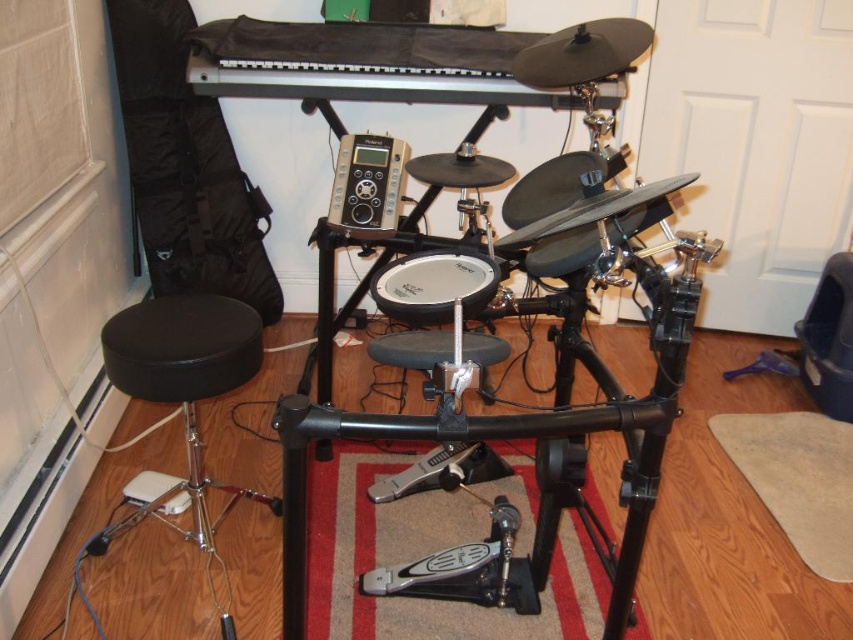
Is black leather stool at lower left smaller than silver metallic speaker at center?

Actually, black leather stool at lower left might be larger than silver metallic speaker at center.

Does black leather stool at lower left have a larger size compared to silver metallic speaker at center?

Yes, black leather stool at lower left is bigger than silver metallic speaker at center.

Between point (215, 323) and point (338, 179), which one is positioned behind?

Positioned behind is point (215, 323).

The image size is (853, 640). I want to click on black leather stool at lower left, so click(x=181, y=388).

Image resolution: width=853 pixels, height=640 pixels. What do you see at coordinates (363, 64) in the screenshot?
I see `black matte keyboard at upper center` at bounding box center [363, 64].

Can you confirm if black matte keyboard at upper center is positioned below silver metallic speaker at center?

No, black matte keyboard at upper center is not below silver metallic speaker at center.

Between point (421, 90) and point (393, 204), which one is positioned in front?

Point (393, 204)

Find the location of a particular element. Image resolution: width=853 pixels, height=640 pixels. black matte keyboard at upper center is located at coordinates (363, 64).

Is point (194, 54) in front of point (167, 490)?

That is False.

Does black matte keyboard at upper center come behind black leather stool at lower left?

That is True.

Is point (363, 33) in front of point (202, 312)?

No.

This screenshot has width=853, height=640. In order to click on black matte keyboard at upper center in this screenshot , I will do `click(363, 64)`.